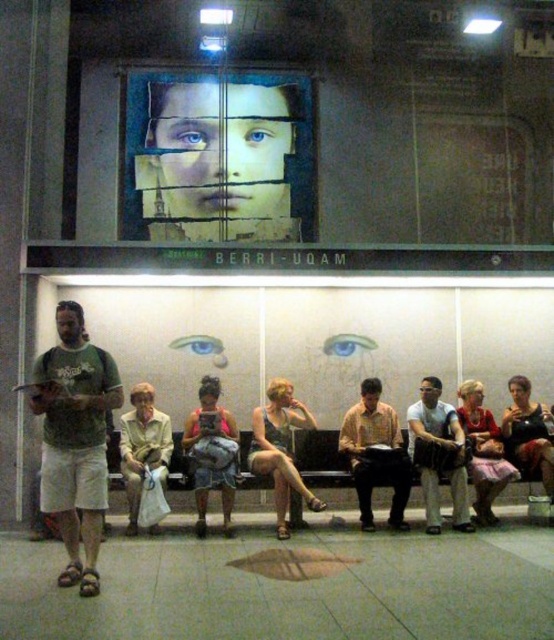
Consider the image. You are a fashion designer observing people at the Berri UQAM subway station. You notice a person wearing a matte gray shirt at center and denim shorts at center. Which clothing item takes up more visual space in the scene?

The matte gray shirt at center takes up more visual space in the scene as it has a larger size compared to the denim shorts at center.